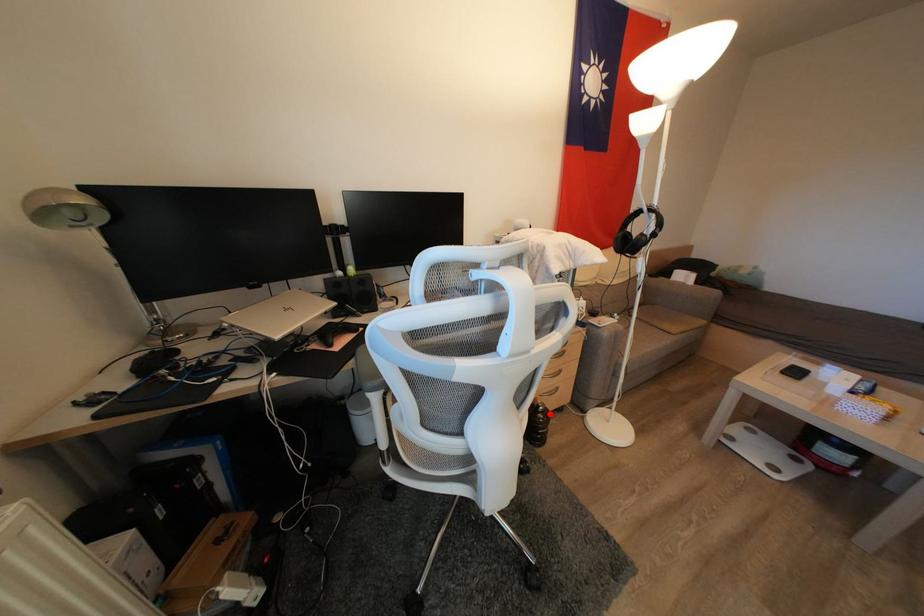
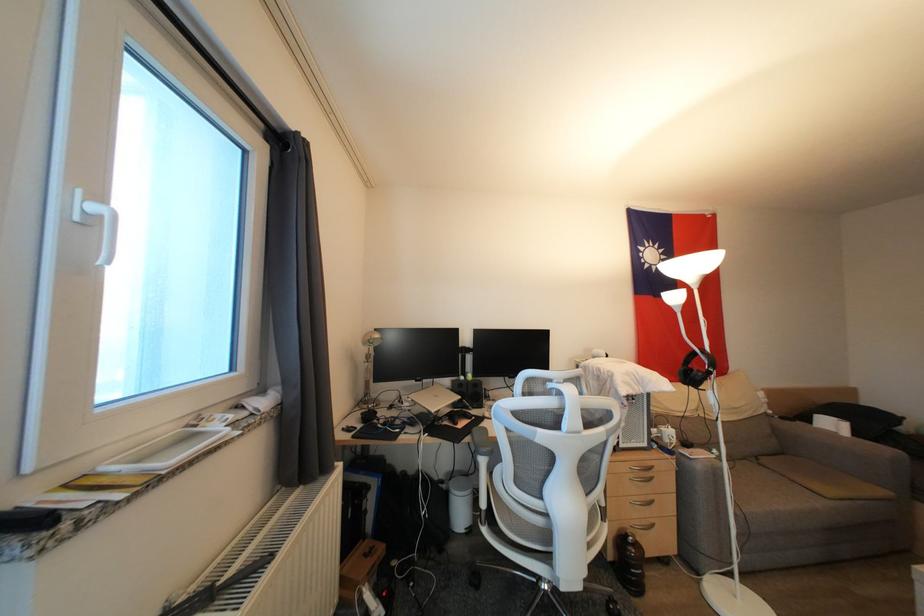
In the second image, find the point that corresponds to the highlighted location in the first image.

(642, 549)